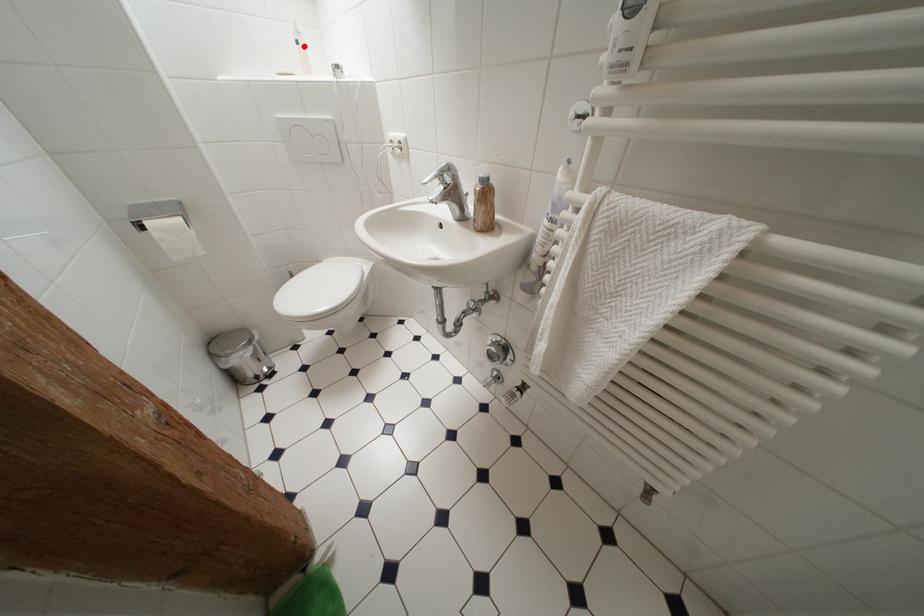
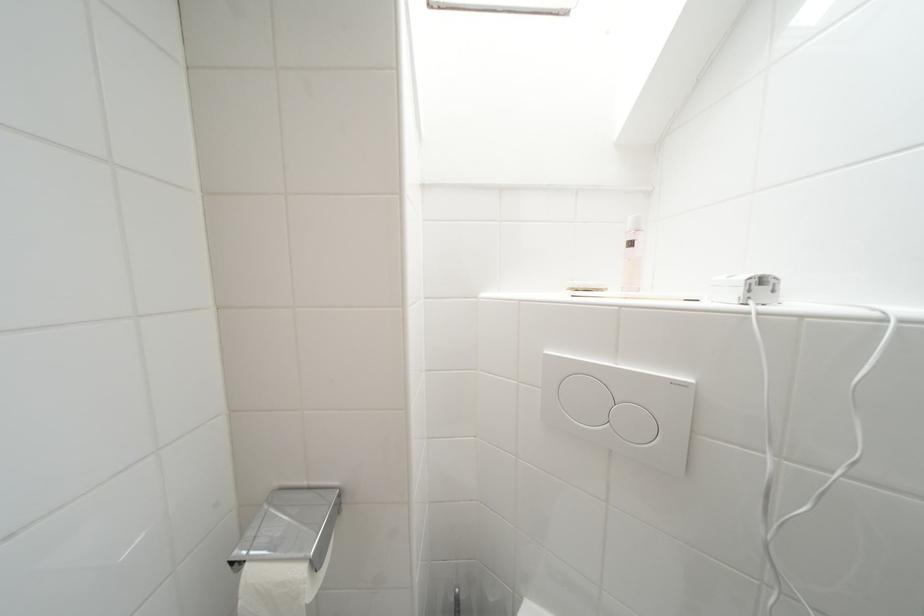
In the second image, find the point that corresponds to the highlighted location in the first image.

(638, 246)